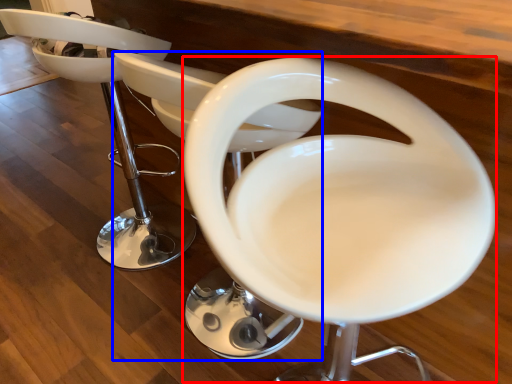
Question: Which object appears closest to the camera in this image, feeding chair (highlighted by a red box) or feeding chair (highlighted by a blue box)?

Choices:
 (A) feeding chair
 (B) feeding chair

Answer: (A)